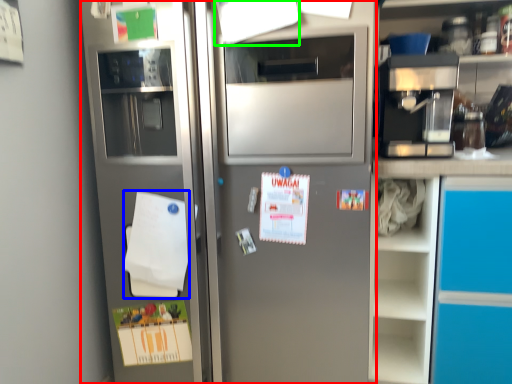
Question: Which object is the farthest from refrigerator (highlighted by a red box)? Choose among these: notepad (highlighted by a blue box) or paper (highlighted by a green box).

Choices:
 (A) notepad
 (B) paper

Answer: (B)